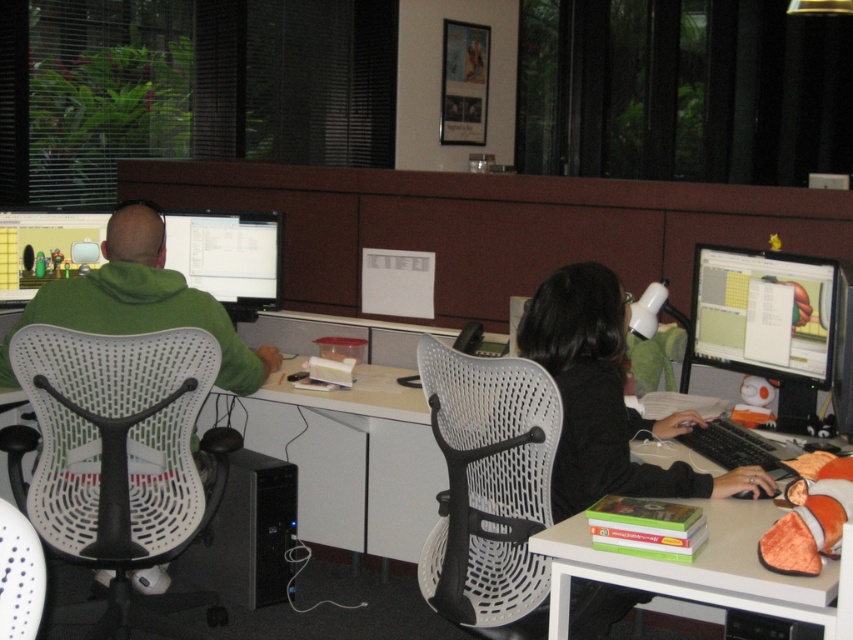
Which is in front, point (753, 256) or point (54, 225)?

Point (753, 256) is more forward.

Does matte plastic monitor at right appear over matte black monitor at upper left?

No.

Which is in front, point (822, 264) or point (102, 228)?

Point (822, 264) is in front.

Find the location of a particular element. The image size is (853, 640). matte plastic monitor at right is located at coordinates (763, 314).

Is white mesh swivel chair at center wider than matte black monitor at upper left?

Indeed, white mesh swivel chair at center has a greater width compared to matte black monitor at upper left.

Between white mesh swivel chair at center and matte black monitor at upper left, which one appears on the left side from the viewer's perspective?

Positioned to the left is matte black monitor at upper left.

Does point (534, 570) lie behind point (18, 305)?

That is False.

Find the location of a particular element. Image resolution: width=853 pixels, height=640 pixels. white mesh swivel chair at center is located at coordinates click(x=489, y=490).

Based on the photo, does white mesh swivel chair at center have a lesser height compared to white plastic table at lower right?

Incorrect, white mesh swivel chair at center's height does not fall short of white plastic table at lower right's.

Is point (473, 612) behind point (575, 560)?

That is True.

Between point (463, 419) and point (851, 584), which one is positioned behind?

Point (463, 419)

Where is `white mesh swivel chair at center`? Image resolution: width=853 pixels, height=640 pixels. white mesh swivel chair at center is located at coordinates (489, 490).